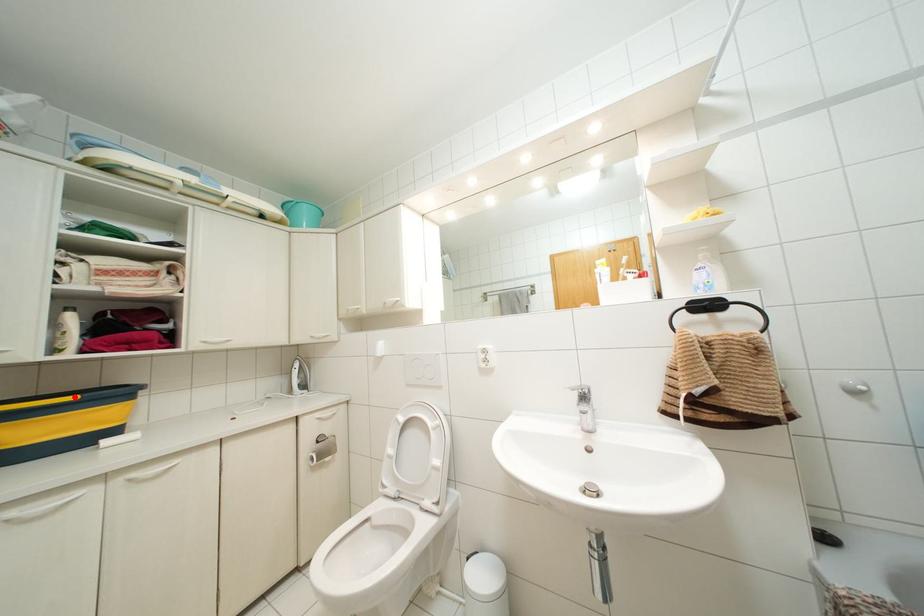
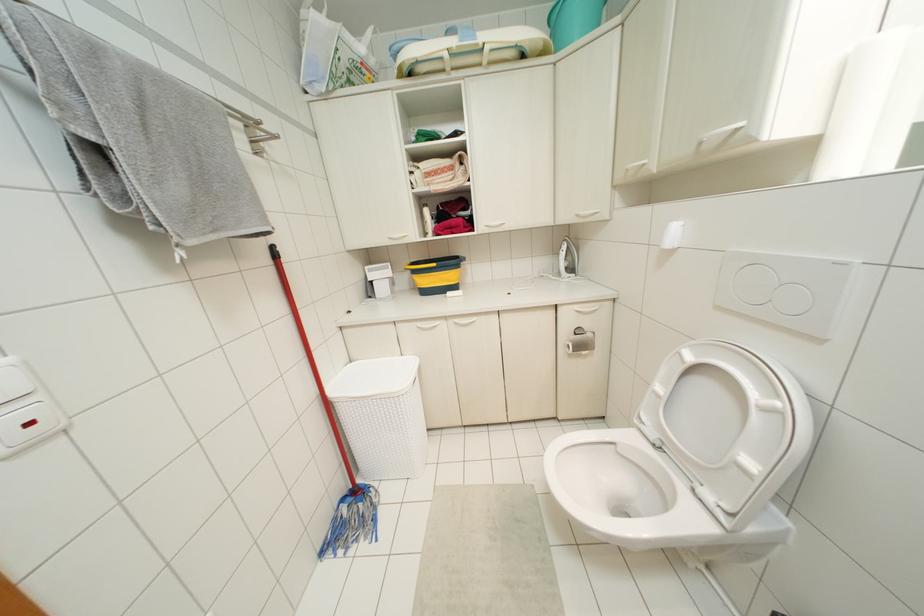
Find the pixel in the second image that matches the highlighted location in the first image.

(433, 264)